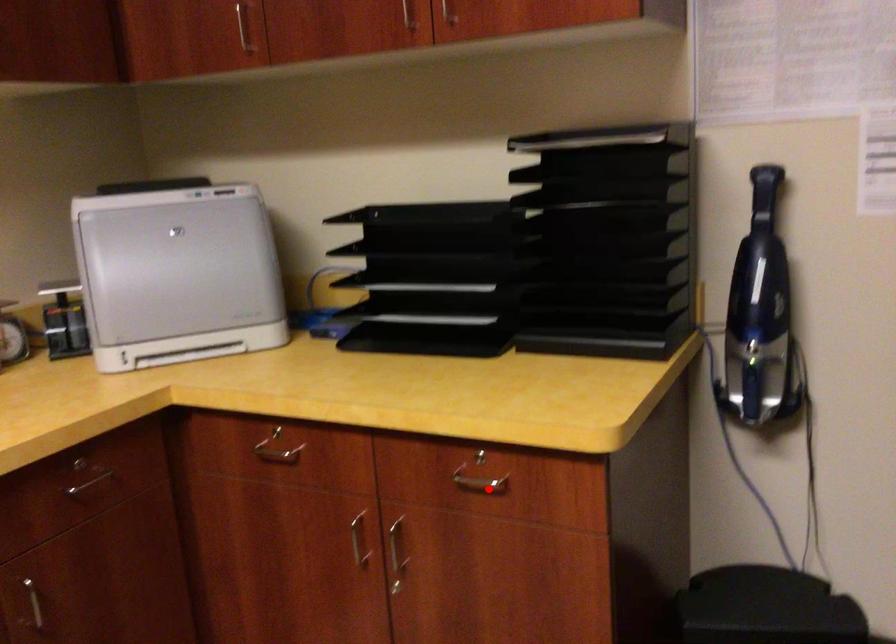
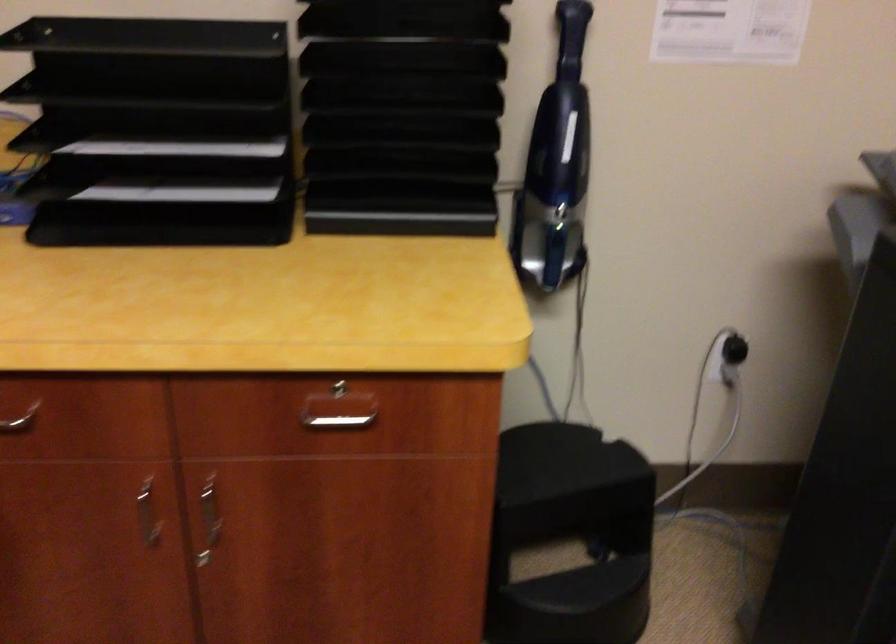
The point at the highlighted location is marked in the first image. Where is the corresponding point in the second image?

(338, 422)